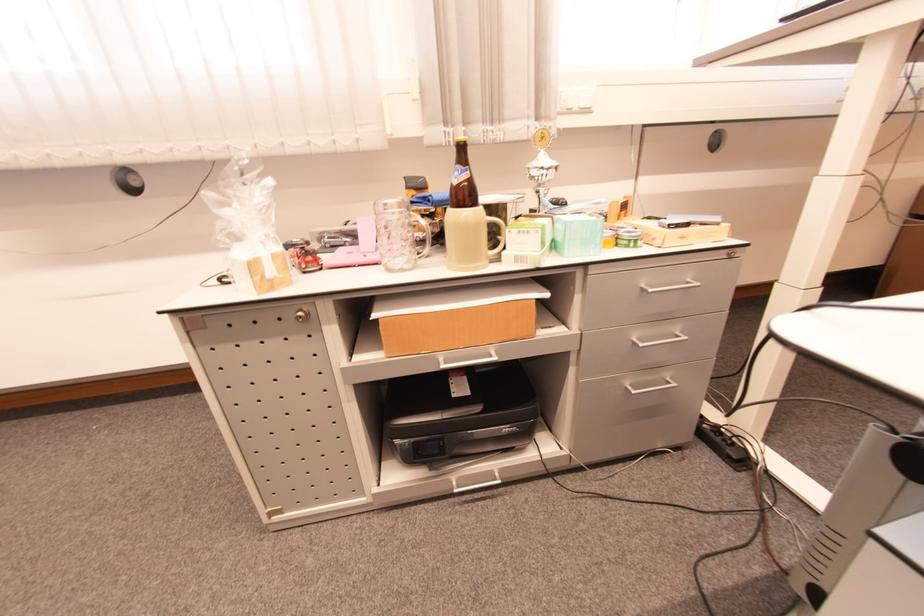
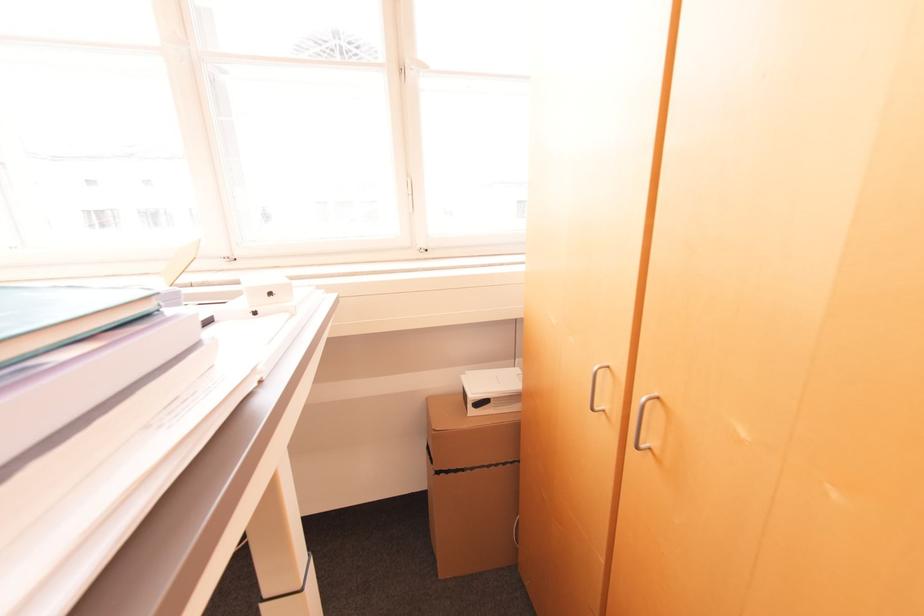
Question: Which direction would the cameraman need to move to produce the second image? Reply with the corresponding letter.

Choices:
 (A) Left
 (B) Right
 (C) Forward
 (D) Backward

Answer: (B)